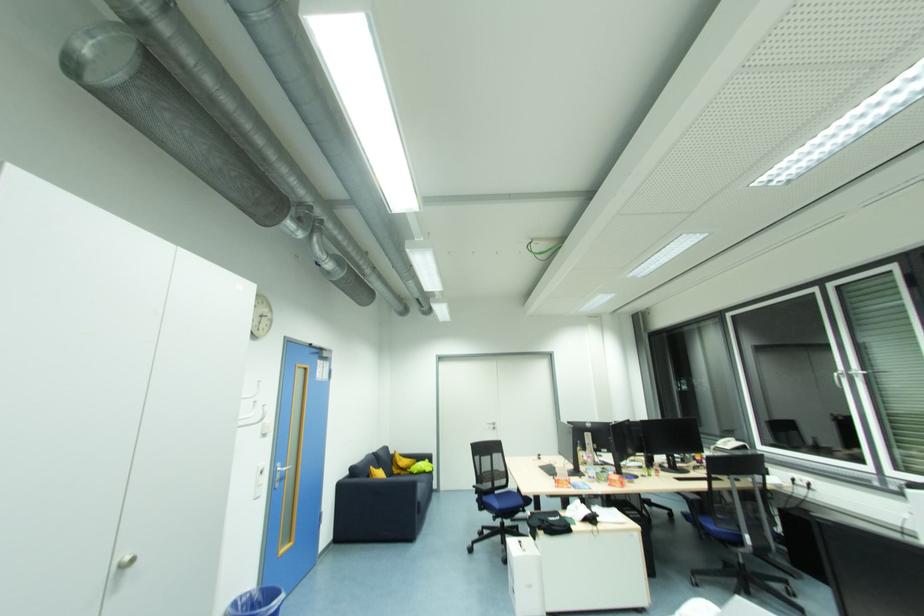
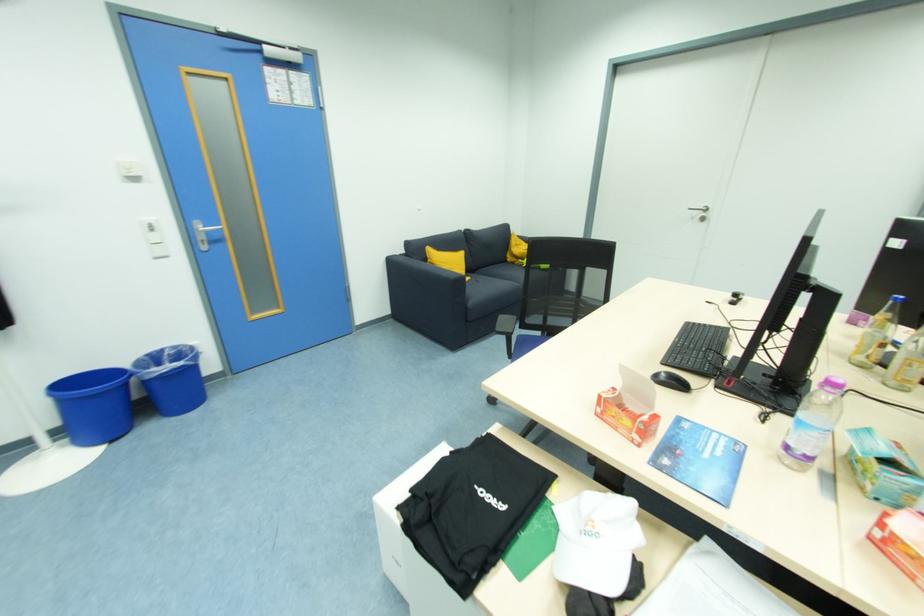
Locate, in the second image, the point that corresponds to point 592,479 in the first image.

(792, 448)